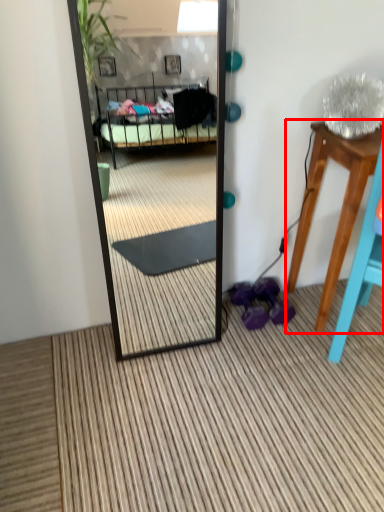
Question: From the image's perspective, what is the correct spatial positioning of table (annotated by the red box) in reference to shoe?

Choices:
 (A) above
 (B) below

Answer: (A)